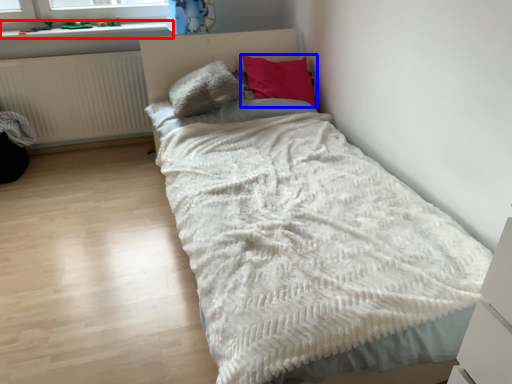
Question: Which object is further to the camera taking this photo, window sill (highlighted by a red box) or pillow (highlighted by a blue box)?

Choices:
 (A) window sill
 (B) pillow

Answer: (A)